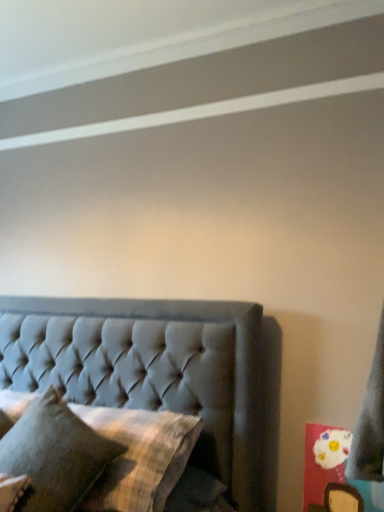
Question: From the image's perspective, would you say plaid fabric pillow at center, arranged as the 1th pillow when ordered from the bottom, is shown under tufted fabric bed at center?

Choices:
 (A) no
 (B) yes

Answer: (B)

Question: Does plaid fabric pillow at center, positioned as the second pillow in top-to-bottom order, appear on the left side of tufted fabric bed at center?

Choices:
 (A) no
 (B) yes

Answer: (A)

Question: From the image's perspective, is plaid fabric pillow at center, arranged as the 1th pillow when ordered from the bottom, on tufted fabric bed at center?

Choices:
 (A) no
 (B) yes

Answer: (A)

Question: Does plaid fabric pillow at center, positioned as the second pillow in top-to-bottom order, come behind tufted fabric bed at center?

Choices:
 (A) no
 (B) yes

Answer: (B)

Question: Can you confirm if plaid fabric pillow at center, arranged as the 1th pillow when ordered from the bottom, is wider than tufted fabric bed at center?

Choices:
 (A) yes
 (B) no

Answer: (B)

Question: Is plaid fabric pillow at center, positioned as the second pillow in top-to-bottom order, taller than tufted fabric bed at center?

Choices:
 (A) no
 (B) yes

Answer: (A)

Question: Can you confirm if tufted fabric bed at center is positioned to the left of textured gray pillow at lower left, the second pillow positioned from the bottom?

Choices:
 (A) yes
 (B) no

Answer: (B)

Question: Is tufted fabric bed at center aimed at textured gray pillow at lower left, which appears as the first pillow when viewed from the top?

Choices:
 (A) no
 (B) yes

Answer: (B)

Question: Is tufted fabric bed at center further to camera compared to textured gray pillow at lower left, which appears as the first pillow when viewed from the top?

Choices:
 (A) no
 (B) yes

Answer: (B)

Question: Can textured gray pillow at lower left, which appears as the first pillow when viewed from the top, be found inside tufted fabric bed at center?

Choices:
 (A) yes
 (B) no

Answer: (A)

Question: Does tufted fabric bed at center have a smaller size compared to textured gray pillow at lower left, the second pillow positioned from the bottom?

Choices:
 (A) no
 (B) yes

Answer: (A)

Question: From the image's perspective, is tufted fabric bed at center located beneath textured gray pillow at lower left, the second pillow positioned from the bottom?

Choices:
 (A) yes
 (B) no

Answer: (A)

Question: From the image's perspective, is textured gray pillow at lower left, the second pillow positioned from the bottom, under plaid fabric pillow at center, arranged as the 1th pillow when ordered from the bottom?

Choices:
 (A) yes
 (B) no

Answer: (B)